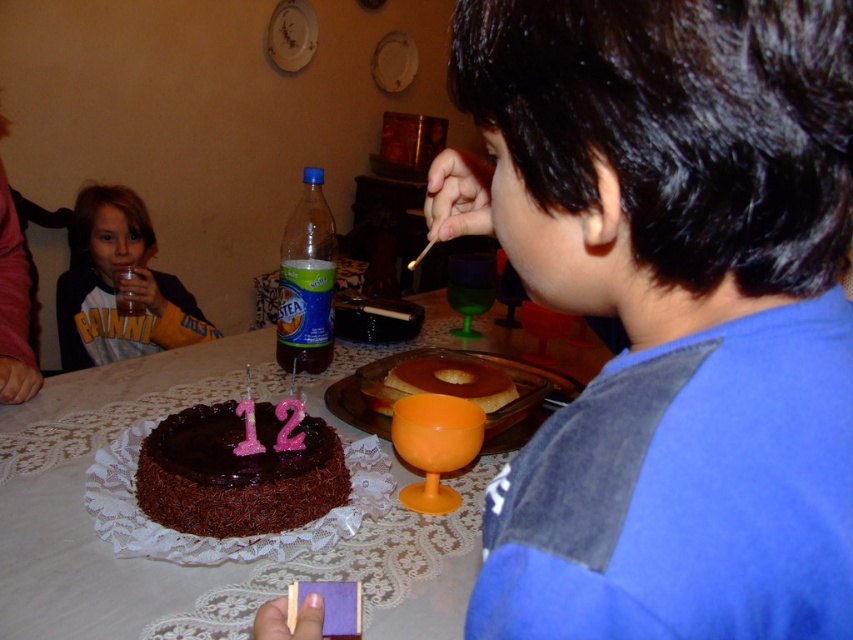
You are a guest at the birthday party and want to grab both the chocolatesmoothcake at lower center and the golden caramel flan at center. Which one is closer to your right side?

The golden caramel flan at center is to the right of chocolatesmoothcake at lower center, so it is closer to your right side.

Based on the photo, you are a guest at the birthday party and want to place a small gift on the table. The gift requires a space larger than the matte yellow shirt at left. Can you place it on the white lace tablecloth at center?

The white lace tablecloth at center is shorter than the matte yellow shirt at left, so it might not provide enough space. Check the table area beyond the tablecloth for a larger space.